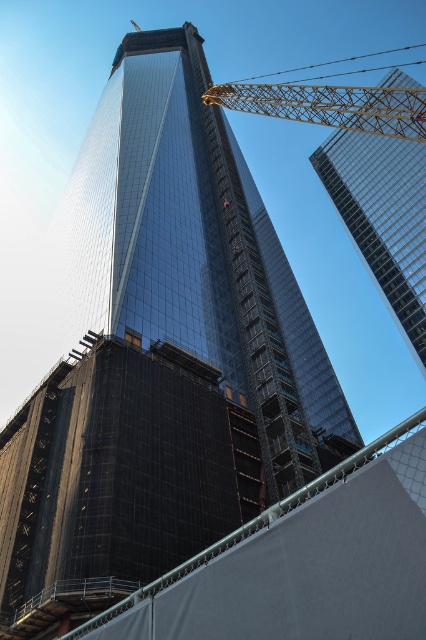
Who is more distant from viewer, (359, 628) or (414, 225)?

The point (414, 225) is more distant.

Which of these two, black mesh scaffolding at center or glassy steel skyscraper at upper right, stands shorter?

black mesh scaffolding at center is shorter.

Locate an element on the screen. The image size is (426, 640). black mesh scaffolding at center is located at coordinates (302, 561).

Does glassy steel skyscraper at upper right have a larger size compared to gold mesh crane at upper center?

Actually, glassy steel skyscraper at upper right might be smaller than gold mesh crane at upper center.

Who is lower down, glassy steel skyscraper at upper right or gold mesh crane at upper center?

Positioned lower is glassy steel skyscraper at upper right.

Which is behind, point (414, 192) or point (411, 132)?

Point (414, 192)

Locate an element on the screen. This screenshot has width=426, height=640. glassy steel skyscraper at upper right is located at coordinates (383, 218).

How distant is black mesh scaffolding at center from gold mesh crane at upper center?

The distance of black mesh scaffolding at center from gold mesh crane at upper center is 221.15 feet.

Does black mesh scaffolding at center appear on the right side of gold mesh crane at upper center?

Incorrect, black mesh scaffolding at center is not on the right side of gold mesh crane at upper center.

Where is `black mesh scaffolding at center`? black mesh scaffolding at center is located at coordinates (302, 561).